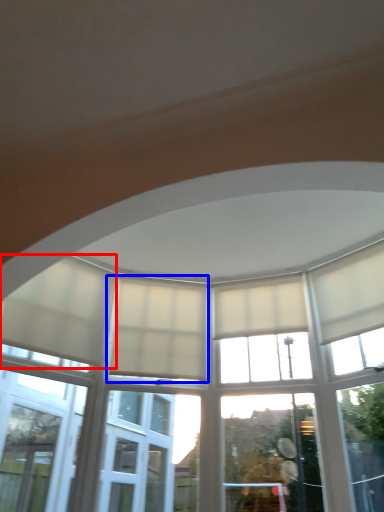
Question: Which point is closer to the camera, curtain (highlighted by a red box) or curtain (highlighted by a blue box)?

Choices:
 (A) curtain
 (B) curtain

Answer: (A)